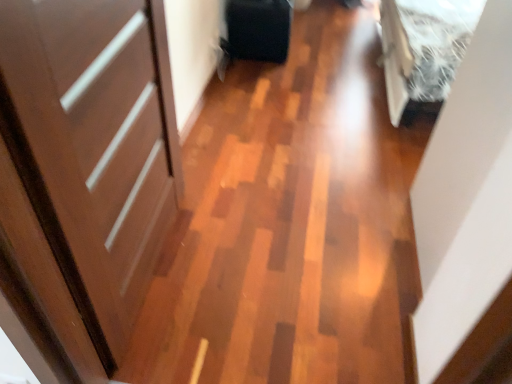
In order to click on free spot to the right of matte brown door at left in this screenshot , I will do 269,265.